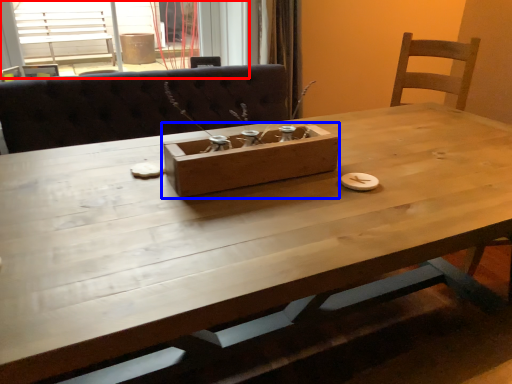
Question: Which object is closer to the camera taking this photo, window (highlighted by a red box) or cardboard box (highlighted by a blue box)?

Choices:
 (A) window
 (B) cardboard box

Answer: (B)